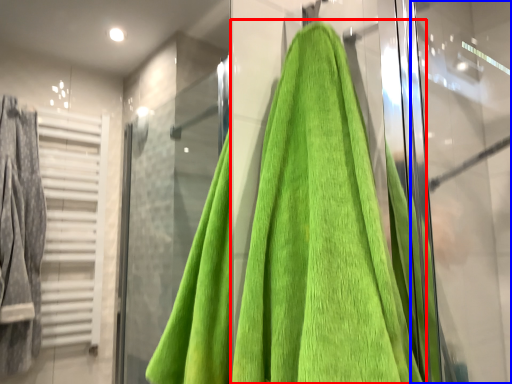
Question: Which of the following is the closest to the observer, towel (highlighted by a red box) or screen door (highlighted by a blue box)?

Choices:
 (A) towel
 (B) screen door

Answer: (A)